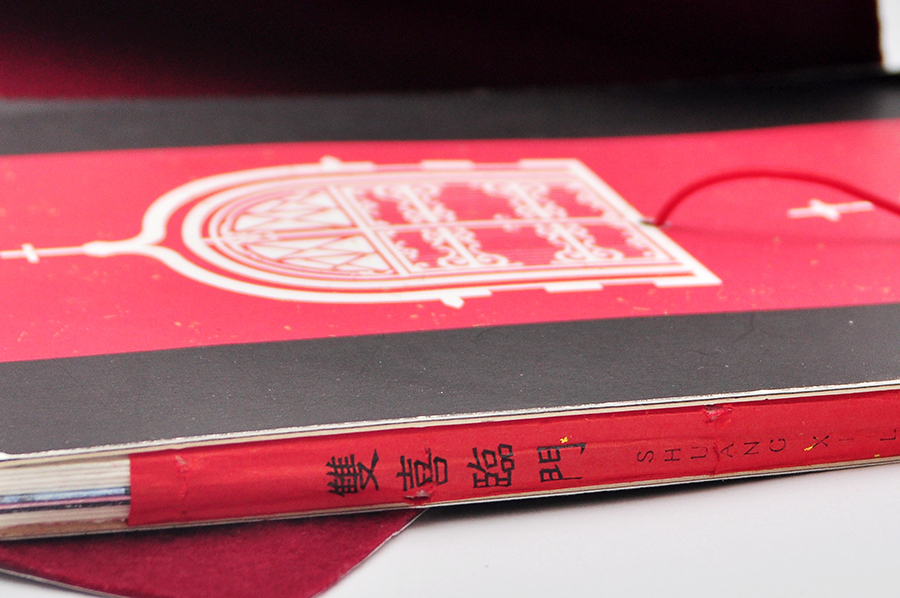
I want to click on red felt, so click(221, 567).